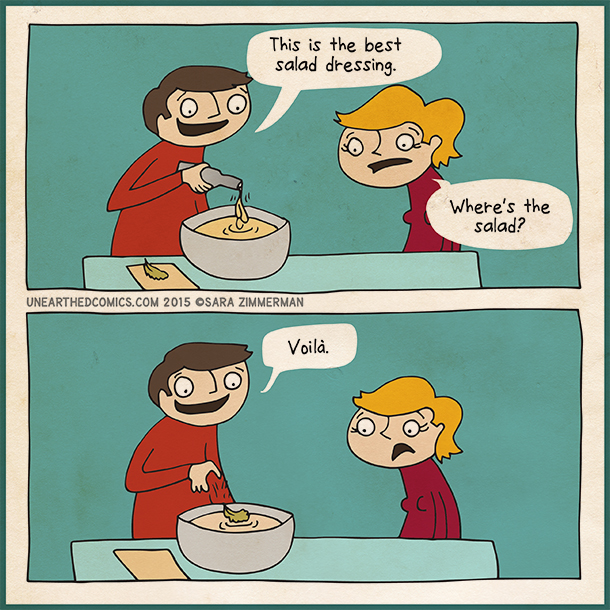
The height and width of the screenshot is (610, 610). Find the location of `bowl`. bowl is located at coordinates (260, 251), (270, 544).